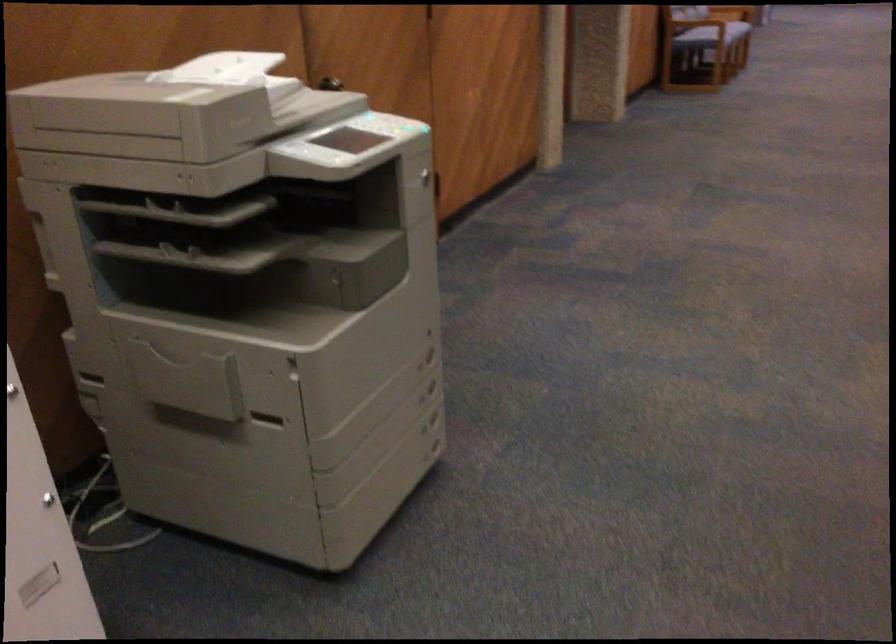
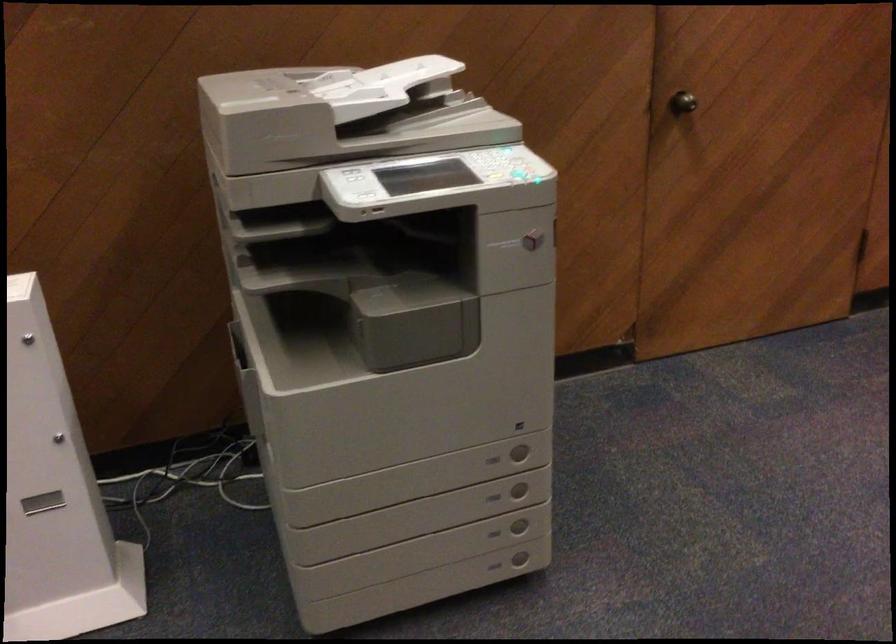
Locate, in the second image, the point that corresponds to [408,128] in the first image.

(521, 176)